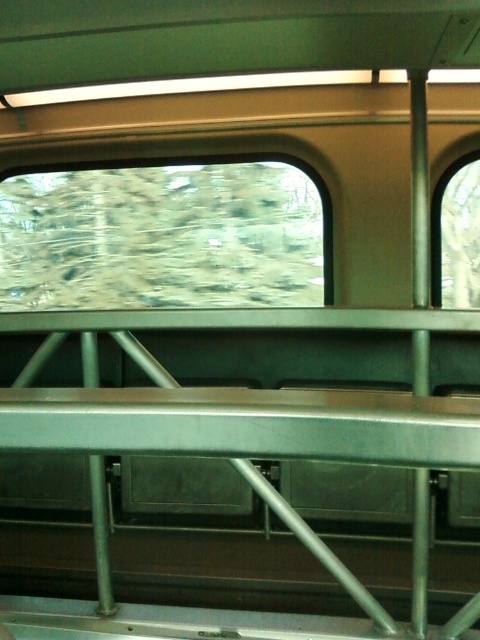
Question: Which point is farther to the camera?

Choices:
 (A) (470, 156)
 (B) (195, 192)

Answer: (B)

Question: Is transparent glass window at center thinner than clear glass window at right?

Choices:
 (A) no
 (B) yes

Answer: (A)

Question: Can you confirm if transparent glass window at center is thinner than clear glass window at right?

Choices:
 (A) yes
 (B) no

Answer: (B)

Question: Is transparent glass window at center above clear glass window at right?

Choices:
 (A) no
 (B) yes

Answer: (B)